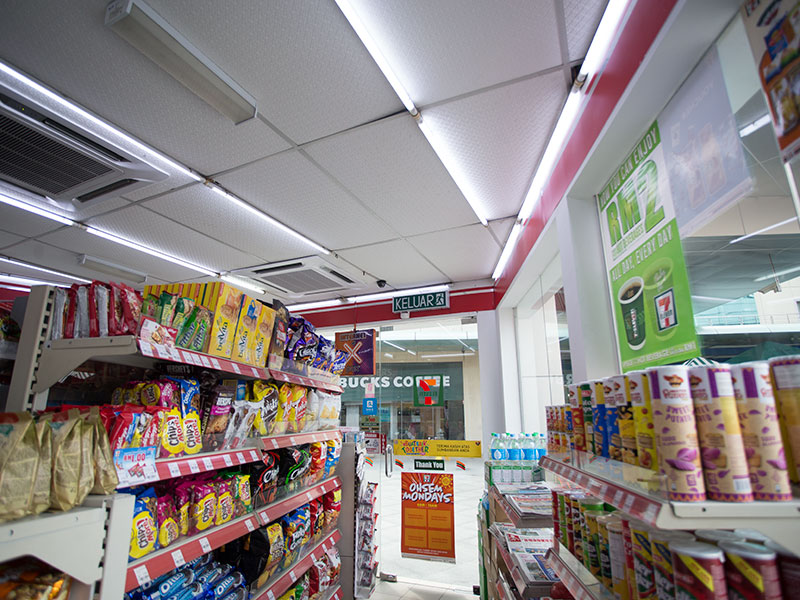
The width and height of the screenshot is (800, 600). Identify the location of ceiling tiles. (378, 192), (344, 202), (257, 228), (204, 246), (424, 240), (382, 263), (494, 170), (229, 148).